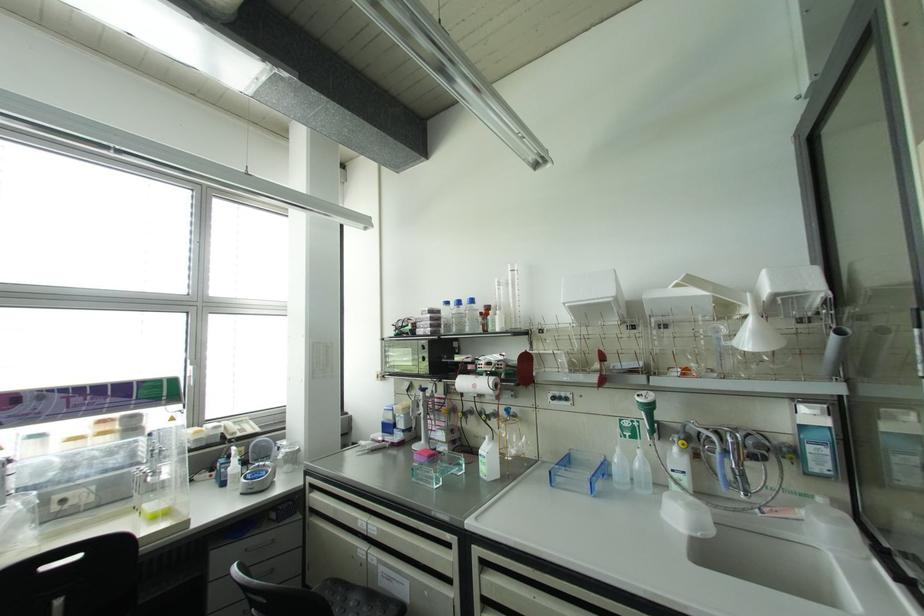
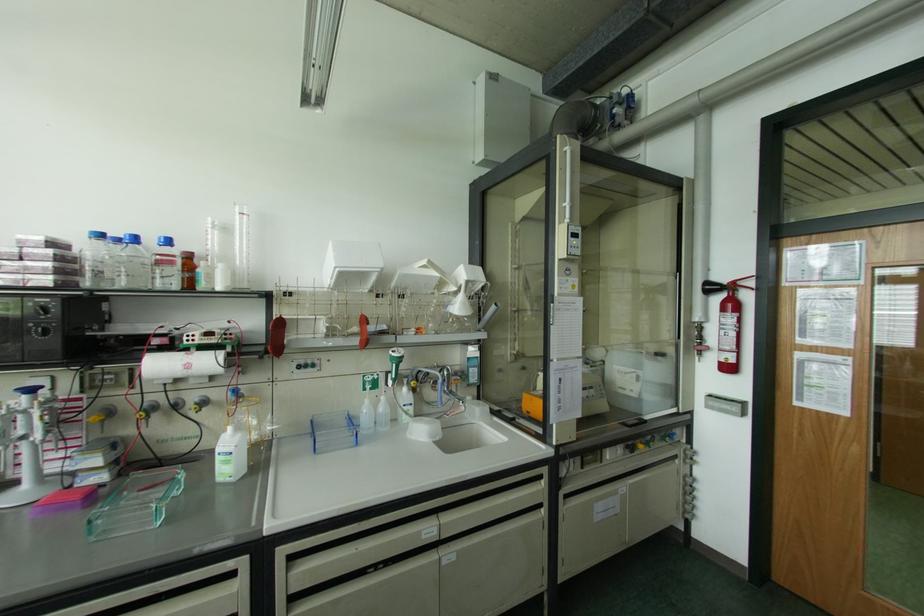
Locate, in the second image, the point that corresponds to (x=471, y=301) in the first image.

(167, 241)